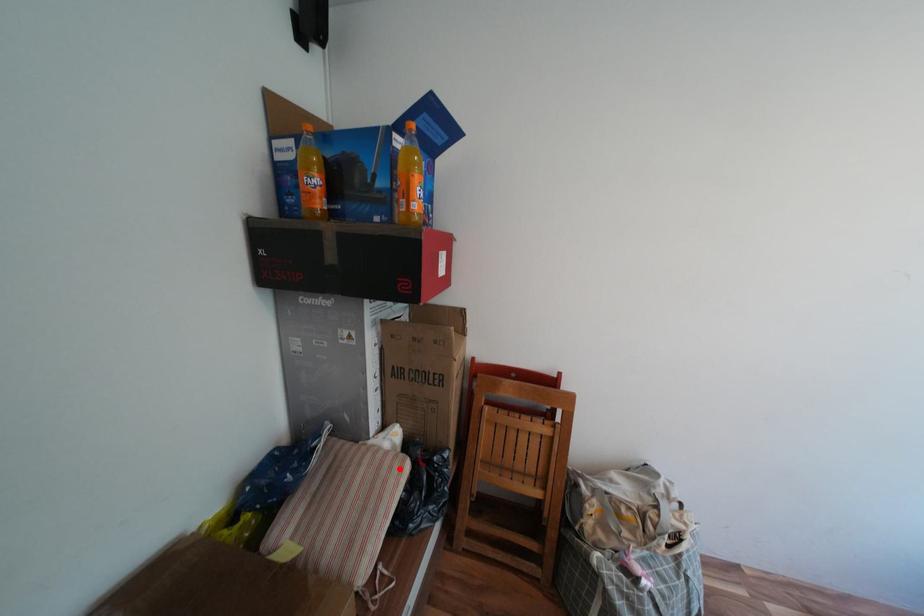
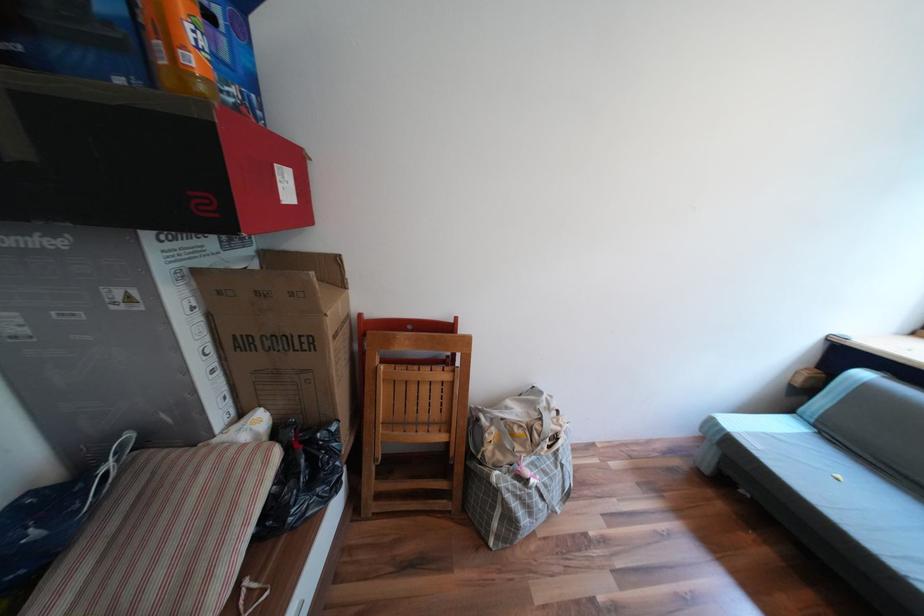
Find the pixel in the second image that matches the highlighted location in the first image.

(258, 464)